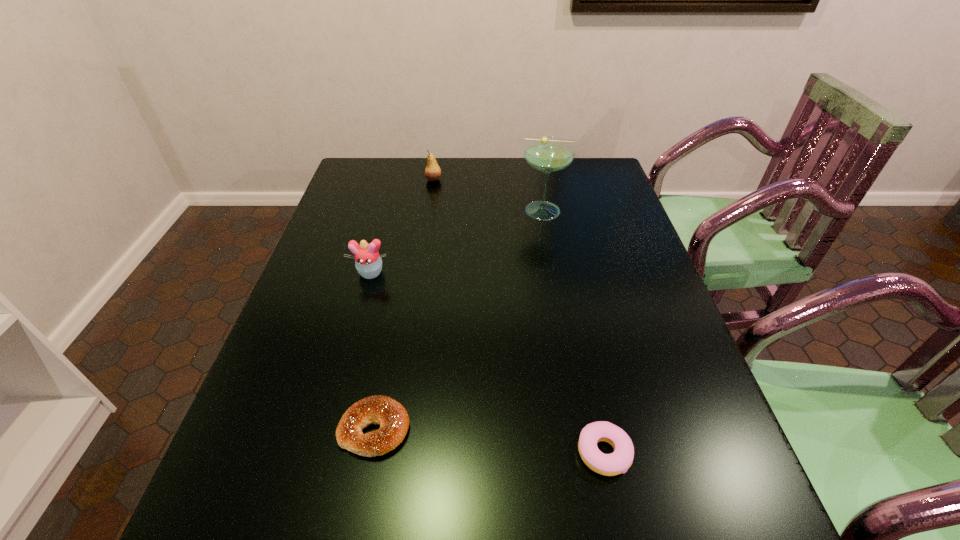
Locate an element on the screen. the tallest object is located at coordinates (548, 154).

This screenshot has height=540, width=960. In order to click on the second farthest object in this screenshot , I will do `click(548, 154)`.

Where is `the farthest object`? This screenshot has height=540, width=960. the farthest object is located at coordinates (432, 172).

Find the location of a particular element. the third farthest object is located at coordinates (368, 262).

This screenshot has height=540, width=960. Identify the location of bagel. (392, 417).

At what (x,y) coordinates should I click in order to perform the action: click on doughnut. Please return your answer as a coordinate pair (x, y). Looking at the image, I should click on (619, 461).

At what (x,y) coordinates should I click in order to perform the action: click on vacant space situated on the left of the tallest object. Please return your answer as a coordinate pair (x, y). Image resolution: width=960 pixels, height=540 pixels. Looking at the image, I should click on (466, 211).

I want to click on free location located on the left of the farthest object, so click(x=405, y=180).

Find the location of `vacant space situated on the face of the cupcake`. vacant space situated on the face of the cupcake is located at coordinates (337, 396).

Find the location of a particular element. This screenshot has height=540, width=960. vacant space located on the back of the bagel is located at coordinates (396, 313).